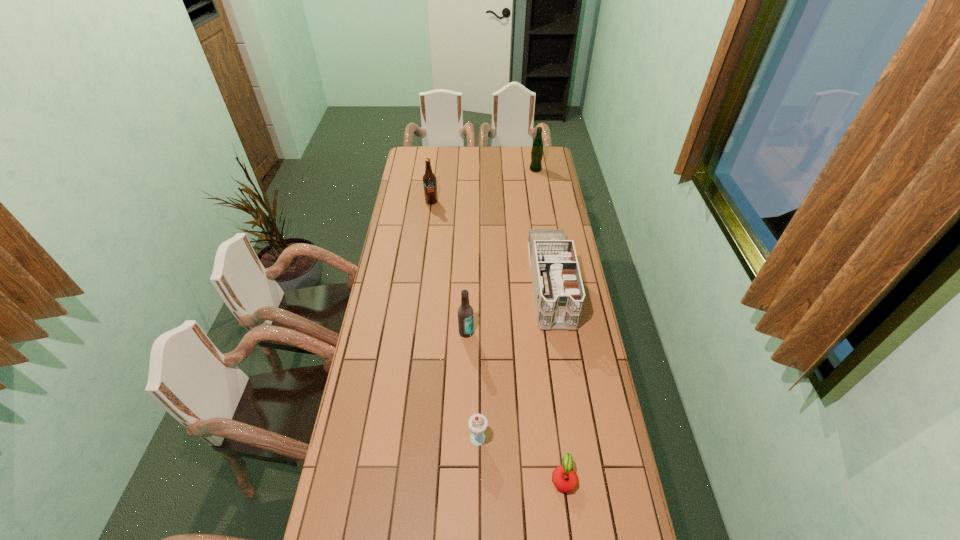
Locate an element on the screen. free point that satisfies the following two spatial constraints: 1. at the entrance of the dollhouse; 2. on the straw side of the second nearest object is located at coordinates (573, 435).

Find the location of `free spot that satisfies the following two spatial constraints: 1. at the entrance of the dollhouse; 2. on the straw side of the second nearest object`. free spot that satisfies the following two spatial constraints: 1. at the entrance of the dollhouse; 2. on the straw side of the second nearest object is located at coordinates (573, 435).